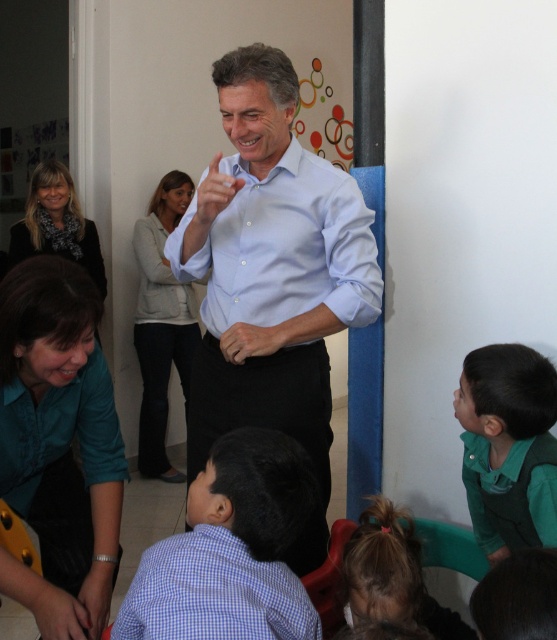
Where is the light blue cotton shirt at center located in the image?

The light blue cotton shirt at center is located at point (285, 246).

You are standing in the classroom and want to move from the point at coordinates point (x=113, y=435) to the point at coordinates point (x=234, y=212). Which direction should you move in?

Since point (x=113, y=435) is in front of point (x=234, y=212), you should move backward to reach point (x=234, y=212) from point (x=113, y=435).